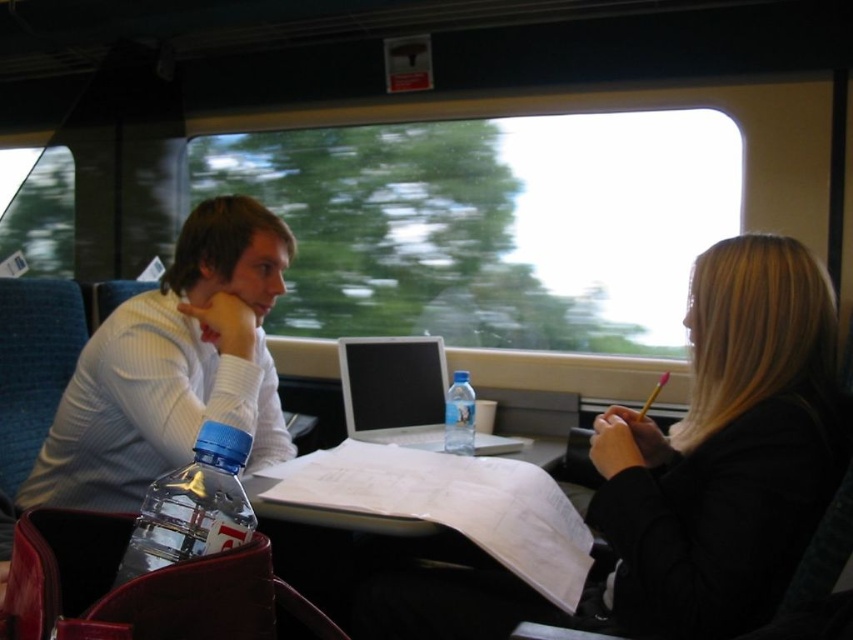
Who is higher up, black matte jacket at right or silver metallic laptop at center?

Positioned higher is black matte jacket at right.

Looking at this image, is black matte jacket at right thinner than silver metallic laptop at center?

Yes.

Does point (793, 353) come in front of point (392, 413)?

Yes, point (793, 353) is in front of point (392, 413).

The image size is (853, 640). Find the location of `black matte jacket at right`. black matte jacket at right is located at coordinates (728, 449).

Who is more forward, (686,630) or (466,440)?

Point (686,630) is more forward.

Is point (706, 500) positioned in front of point (451, 388)?

That is True.

What do you see at coordinates (728, 449) in the screenshot?
I see `black matte jacket at right` at bounding box center [728, 449].

Where is `black matte jacket at right`? The width and height of the screenshot is (853, 640). black matte jacket at right is located at coordinates (728, 449).

Can you confirm if silver metallic laptop at center is taller than clear plastic bottle at center?

Indeed, silver metallic laptop at center has a greater height compared to clear plastic bottle at center.

Which is below, silver metallic laptop at center or clear plastic bottle at center?

Positioned lower is clear plastic bottle at center.

Is point (387, 420) farther from viewer compared to point (465, 394)?

Yes, point (387, 420) is farther from viewer.

Locate an element on the screen. This screenshot has width=853, height=640. silver metallic laptop at center is located at coordinates (393, 388).